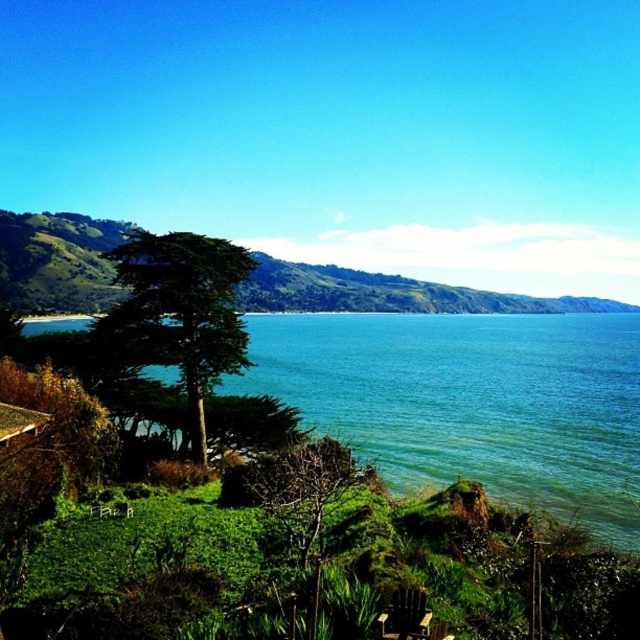
You are standing on the grassy area near the green leafy tree at lower center and want to walk to the blue water at center. Which direction should you head towards?

The blue water at center is to the right of the green leafy tree at lower center, so you should head towards the right direction to reach it.